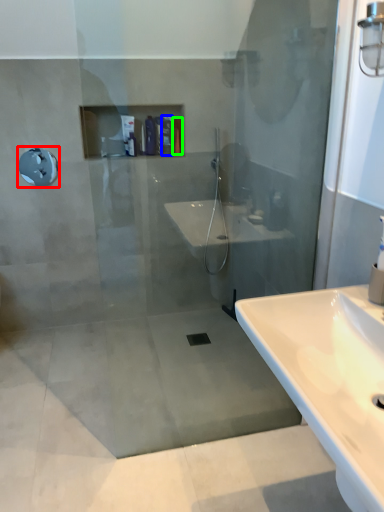
Question: Estimate the real-world distances between objects in this image. Which object is closer to shower (highlighted by a red box), toiletry (highlighted by a blue box) or toiletry (highlighted by a green box)?

Choices:
 (A) toiletry
 (B) toiletry

Answer: (A)